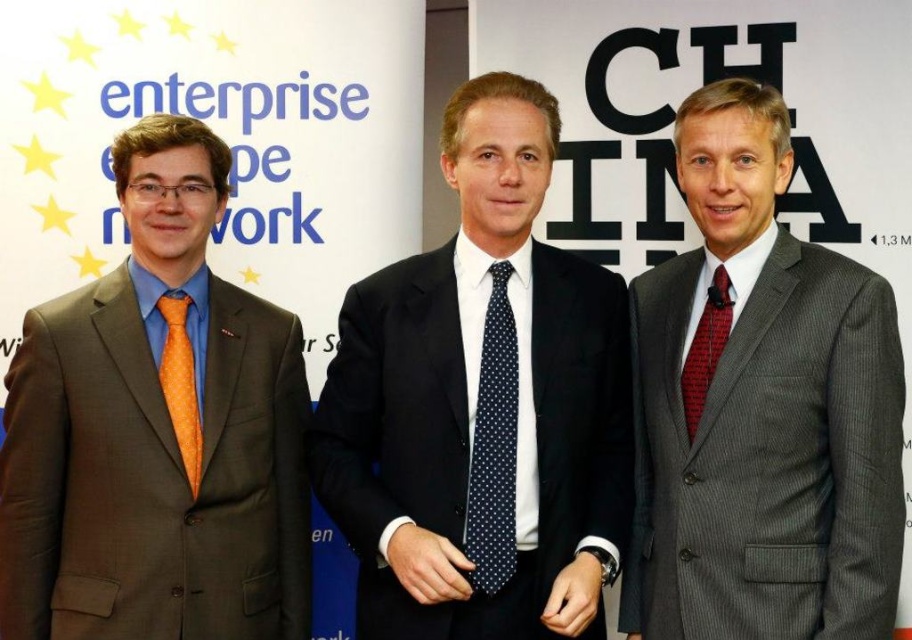
Based on the scene description, which object is taller between the gray pinstripe suit at right and the orange dotted tie at left?

The gray pinstripe suit at right is taller than the orange dotted tie at left.